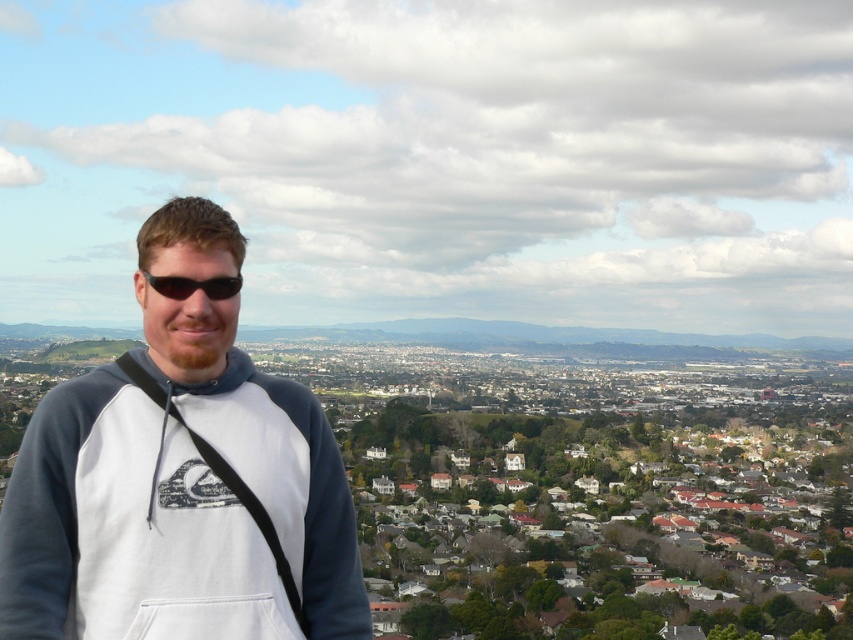
You are a drone operator tasked with capturing aerial shots of the urban landscape. You need to ensure your drone stays above the person at the viewpoint to avoid interference. Given the distance between the white fleece sweatshirt at center and the black matte sunglasses at center, what is the minimum horizontal distance your drone must maintain from the person to comply with safety regulations requiring a 100 meter buffer zone?

The white fleece sweatshirt at center and black matte sunglasses at center are 84.63 meters apart. Since the required safety buffer is 100 meters, the drone must maintain a minimum horizontal distance greater than 100 meters from the person to comply with regulations.

You are a fashion designer analyzing the outfit of a person in an urban landscape. The person is wearing a white fleece sweatshirt at center and black matte sunglasses at center. Which clothing item is positioned to the left?

The white fleece sweatshirt at center is positioned to the left of the black matte sunglasses at center.

You are a delivery drone operator. Your task is to deliver a package to the person wearing a gray and white hoodie at the viewpoint. The package must be placed precisely at point (x=178, y=480). However, there is an object at that point. What is the object blocking the delivery location?

The object blocking the delivery location at point (x=178, y=480) is a white fleece sweatshirt at center.